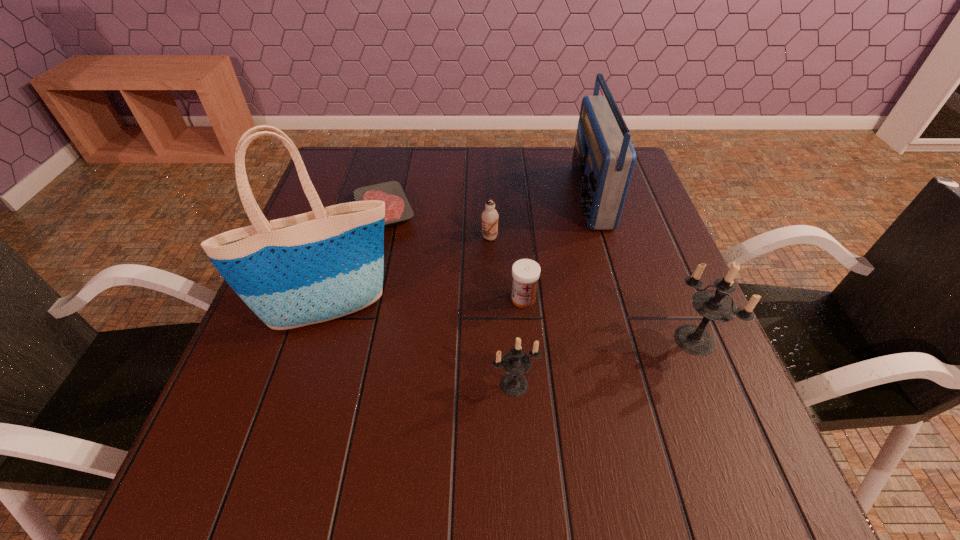
What are the coordinates of `steak present at the far edge` in the screenshot? It's located at (398, 209).

Image resolution: width=960 pixels, height=540 pixels. What are the coordinates of `object that is at the near edge` in the screenshot? It's located at (516, 362).

At what (x,y) coordinates should I click in order to perform the action: click on steak situated at the left edge. Please return your answer as a coordinate pair (x, y). This screenshot has height=540, width=960. Looking at the image, I should click on (398, 209).

This screenshot has width=960, height=540. Identify the location of tote bag located in the left edge section of the desktop. (291, 272).

You are a GUI agent. You are given a task and a screenshot of the screen. Output one action in this format:
    pyautogui.click(x=<x>, y=<y>)
    Task: Click on the candle holder that is at the right edge
    The width and height of the screenshot is (960, 540).
    Given the screenshot: What is the action you would take?
    pyautogui.click(x=713, y=305)

Locate an element on the screen. Image resolution: width=960 pixels, height=540 pixels. radio receiver positioned at the right edge is located at coordinates (603, 161).

The width and height of the screenshot is (960, 540). Find the location of `object present at the far left corner`. object present at the far left corner is located at coordinates (398, 209).

The width and height of the screenshot is (960, 540). I want to click on object at the far right corner, so click(x=603, y=161).

Identify the location of free region at the near edge of the desktop. (640, 394).

In the image, there is a desktop. Identify the location of vacant space at the right edge. Image resolution: width=960 pixels, height=540 pixels. (660, 309).